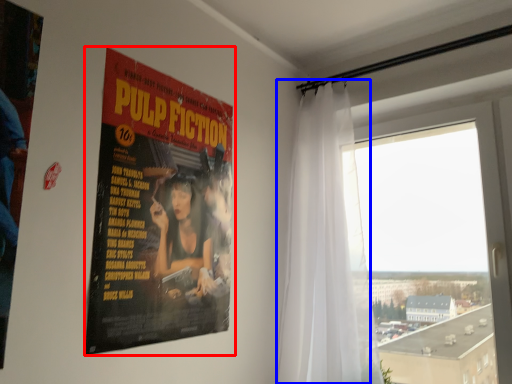
Question: Which of the following is the closest to the observer, poster (highlighted by a red box) or curtain (highlighted by a blue box)?

Choices:
 (A) poster
 (B) curtain

Answer: (A)